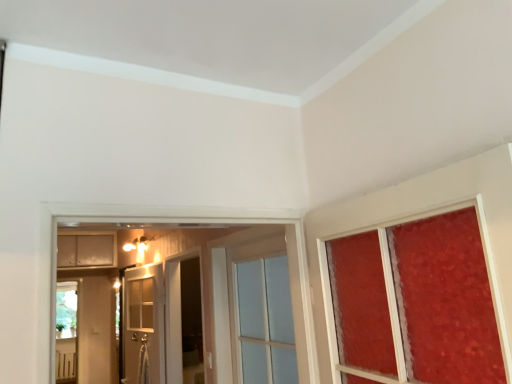
Question: From a real-world perspective, is transparent glass screen door at center on matte white cabinet at upper left?

Choices:
 (A) yes
 (B) no

Answer: (B)

Question: Could matte white cabinet at upper left be considered to be inside transparent glass screen door at center?

Choices:
 (A) no
 (B) yes

Answer: (A)

Question: From a real-world perspective, is transparent glass screen door at center physically below matte white cabinet at upper left?

Choices:
 (A) no
 (B) yes

Answer: (B)

Question: Can you confirm if transparent glass screen door at center is smaller than matte white cabinet at upper left?

Choices:
 (A) no
 (B) yes

Answer: (B)

Question: Would you say transparent glass screen door at center is outside matte white cabinet at upper left?

Choices:
 (A) no
 (B) yes

Answer: (B)

Question: From the image's perspective, is matte white cabinet at upper left above or below clear glass door at center, marked as the 1th door in a right-to-left arrangement?

Choices:
 (A) below
 (B) above

Answer: (A)

Question: From a real-world perspective, relative to clear glass door at center, marked as the 1th door in a right-to-left arrangement, is matte white cabinet at upper left vertically above or below?

Choices:
 (A) above
 (B) below

Answer: (A)

Question: In the image, is matte white cabinet at upper left on the left side or the right side of clear glass door at center, the second door positioned from the left?

Choices:
 (A) left
 (B) right

Answer: (A)

Question: Considering the positions of point (71, 266) and point (253, 367), is point (71, 266) closer or farther from the camera than point (253, 367)?

Choices:
 (A) closer
 (B) farther

Answer: (B)

Question: Is clear glass door at center, the second door positioned from the left, in front of or behind matte white cabinet at upper left in the image?

Choices:
 (A) behind
 (B) front

Answer: (B)

Question: Is clear glass door at center, the second door positioned from the left, wider or thinner than matte white cabinet at upper left?

Choices:
 (A) thin
 (B) wide

Answer: (A)

Question: Would you say clear glass door at center, the second door positioned from the left, is to the left or to the right of matte white cabinet at upper left in the picture?

Choices:
 (A) left
 (B) right

Answer: (B)

Question: Based on their sizes in the image, would you say clear glass door at center, marked as the 1th door in a right-to-left arrangement, is bigger or smaller than matte white cabinet at upper left?

Choices:
 (A) small
 (B) big

Answer: (A)

Question: In terms of width, does clear glass door at center, marked as the 1th door in a right-to-left arrangement, look wider or thinner when compared to transparent glass screen door at center?

Choices:
 (A) wide
 (B) thin

Answer: (B)

Question: From the image's perspective, is clear glass door at center, which is the 1th door from front to back, located above or below transparent glass screen door at center?

Choices:
 (A) above
 (B) below

Answer: (A)